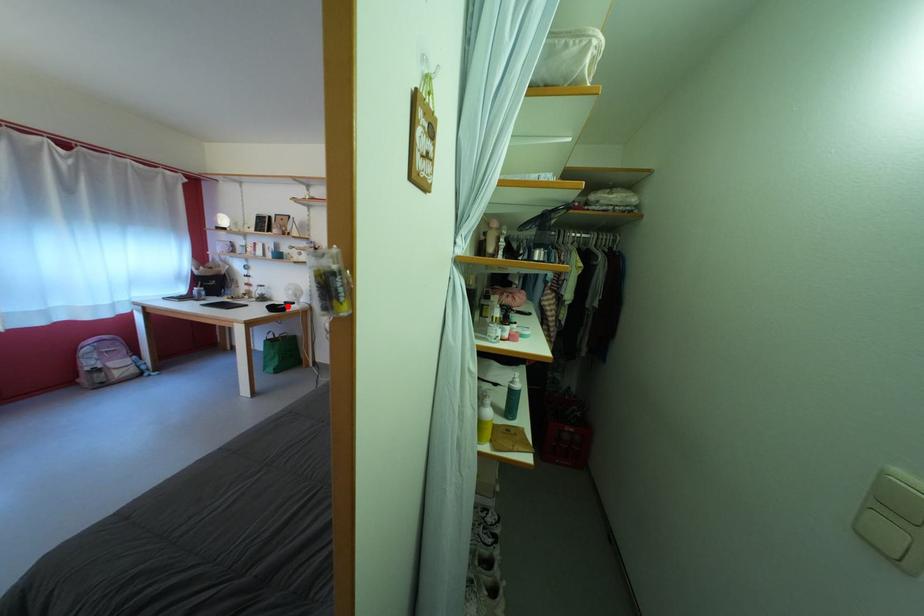
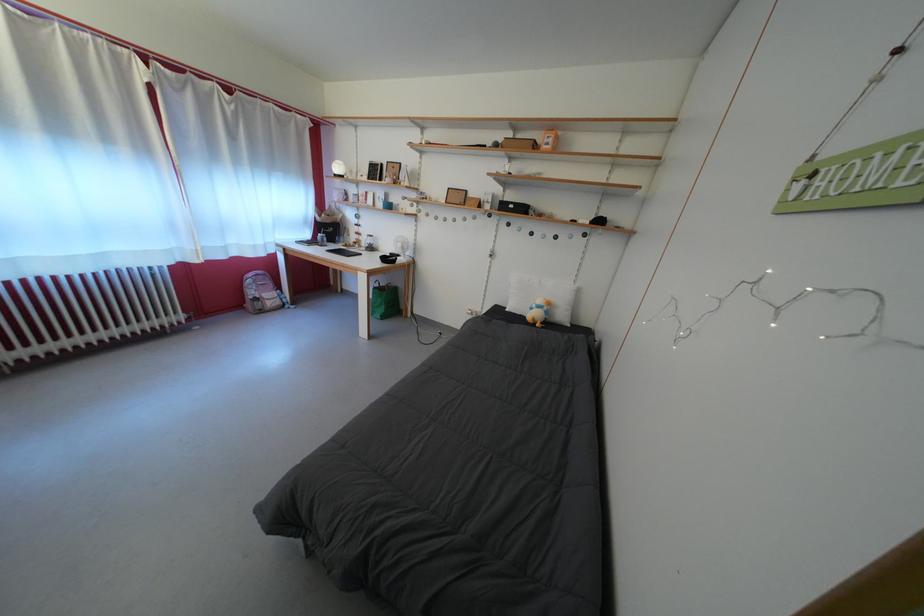
Question: I am providing you with two images of the same scene from different viewpoints. Given a red point in image1, look at the same physical point in image2. Is it:

Choices:
 (A) Closer to the viewpoint
 (B) Farther from the viewpoint

Answer: (A)